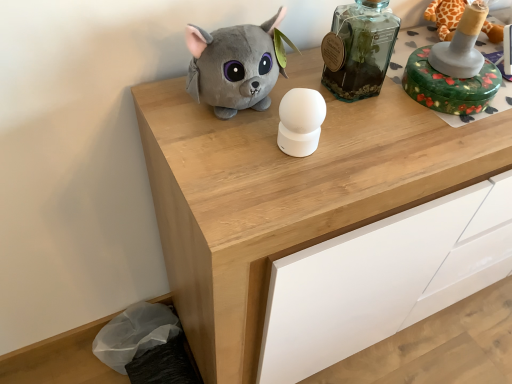
You are a GUI agent. You are given a task and a screenshot of the screen. Output one action in this format:
    pyautogui.click(x=<x>, y=<y>)
    Task: Click on the free location in front of soft plush cat at upper center, positioned as the 2th toy in right-to-left order
    
    Given the screenshot: What is the action you would take?
    pyautogui.click(x=247, y=167)